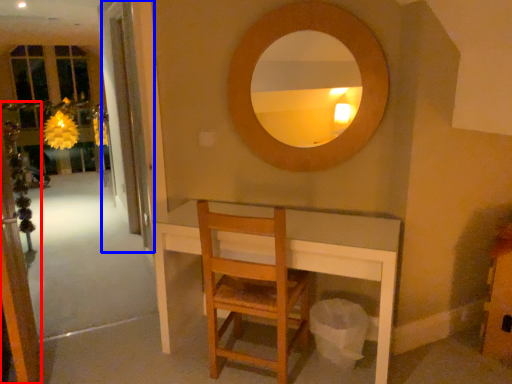
Question: Which object is closer to the camera taking this photo, screen door (highlighted by a red box) or screen door (highlighted by a blue box)?

Choices:
 (A) screen door
 (B) screen door

Answer: (A)